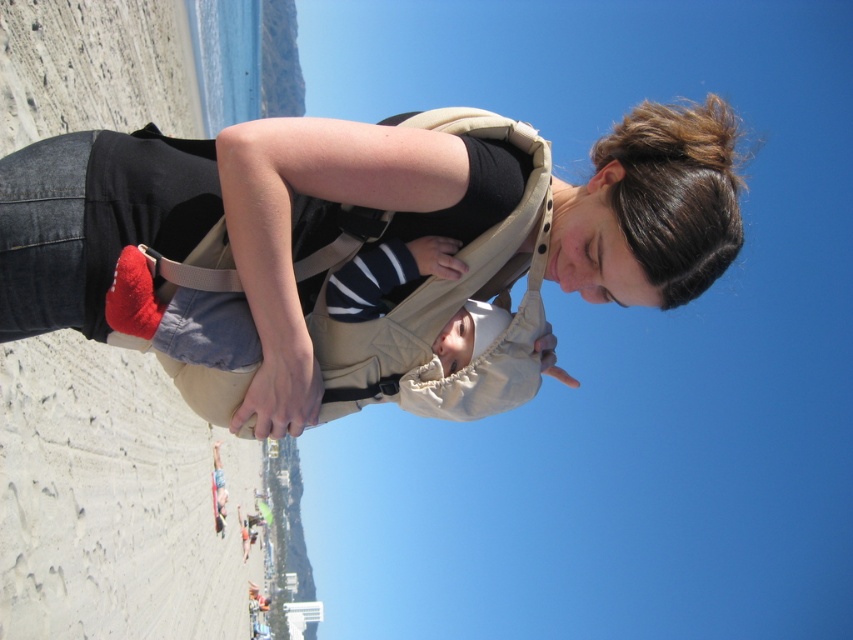
You are standing on the beach and see two points marked on the sand. The first point is at coordinates point (9, 246) and the second is at point (305, 260). Which point is closer to you?

Point (9, 246) is closer to the viewer than point (305, 260).

You are a photographer trying to capture a closeup of the baby in the matte beige baby carrier at center and the tan fabric strap at center. Given that your camera can focus on objects within a 15 feet range, will both objects be in focus?

The matte beige baby carrier at center is 20.85 feet away from the tan fabric strap at center. Since the camera can only focus within 15 feet, the distance between them exceeds the focus range, so both objects cannot be in focus simultaneously.

You are a photographer trying to capture the baby in the matte beige baby carrier at center. Since the tan fabric strap at center is in the way, can you adjust your angle to avoid the strap while still focusing on the baby?

The matte beige baby carrier at center is positioned over the tan fabric strap at center, so adjusting your angle slightly downward might allow you to focus on the baby while avoiding the strap.